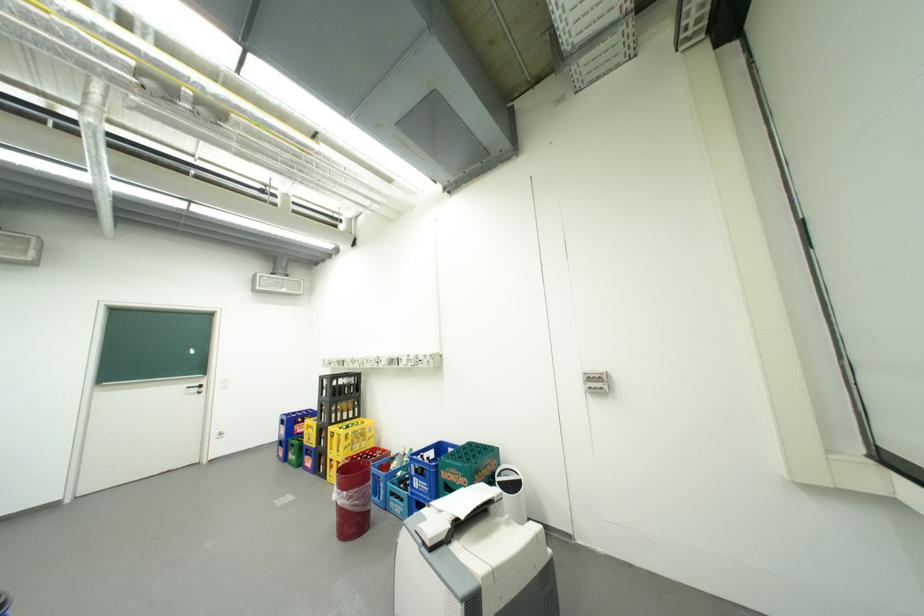
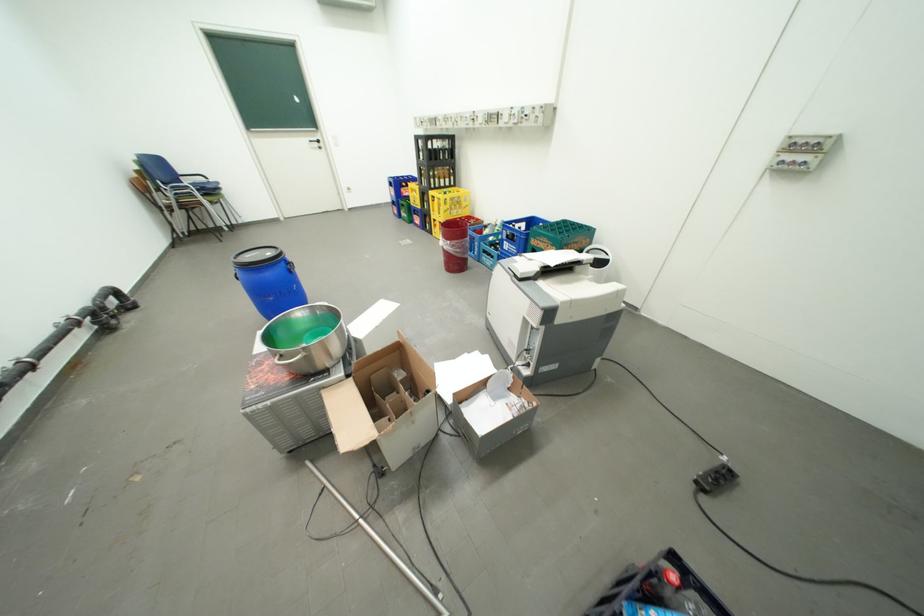
In the second image, find the point that corresponds to pixel 333 395 in the first image.

(430, 159)